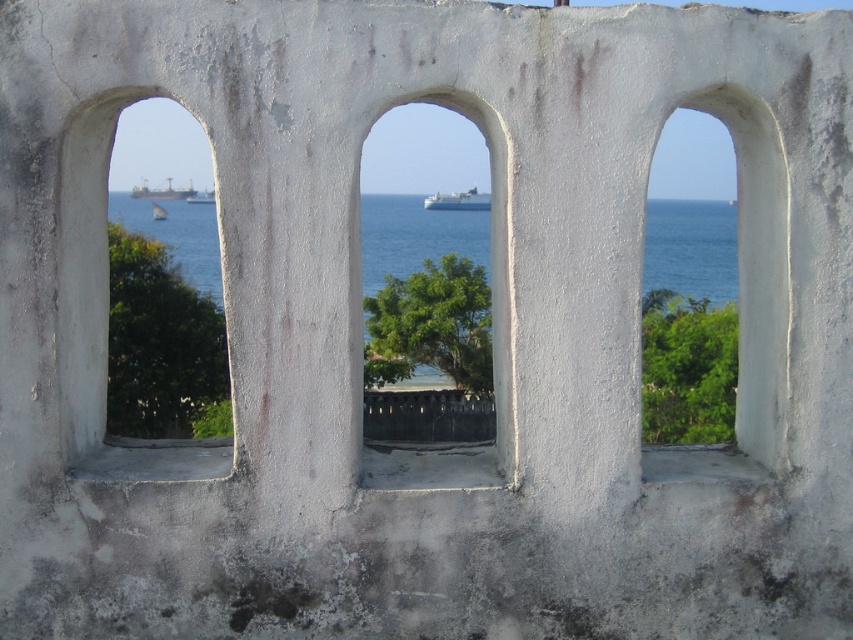
Consider the image. Can you confirm if blue water at center is positioned to the right of white concrete arch at center?

Indeed, blue water at center is positioned on the right side of white concrete arch at center.

This screenshot has width=853, height=640. What do you see at coordinates (691, 250) in the screenshot?
I see `blue water at center` at bounding box center [691, 250].

Locate an element on the screen. The width and height of the screenshot is (853, 640). blue water at center is located at coordinates (691, 250).

Does blue water at center have a lesser height compared to metallic gray ship at left?

No, blue water at center is not shorter than metallic gray ship at left.

Is blue water at center taller than metallic gray ship at left?

Correct, blue water at center is much taller as metallic gray ship at left.

This screenshot has width=853, height=640. What do you see at coordinates (691, 250) in the screenshot?
I see `blue water at center` at bounding box center [691, 250].

Identify the location of blue water at center. (691, 250).

Who is taller, white concrete arch at left or metallic gray ship at left?

With more height is white concrete arch at left.

Does white concrete arch at left have a larger size compared to metallic gray ship at left?

Actually, white concrete arch at left might be smaller than metallic gray ship at left.

Measure the distance between point [99,464] and camera.

They are 17.33 feet apart.

This screenshot has width=853, height=640. Find the location of `white concrete arch at left`. white concrete arch at left is located at coordinates (102, 314).